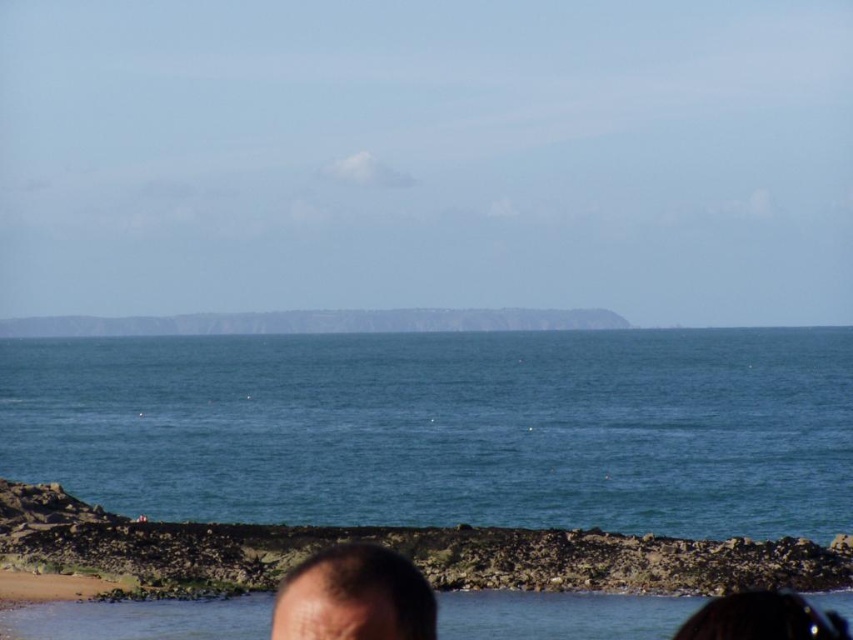
You are standing on the coast and see the rough stone coast at lower center and the dark brown hair at lower center. Which object is closer to the ground?

The rough stone coast at lower center is closer to the ground because it is located below the dark brown hair at lower center.

You are standing at the edge of the coast and see the blue water at center and the rough stone coast at lower center. Which object is closer to you?

The rough stone coast at lower center is behind the blue water at center, so the blue water at center is closer to you.